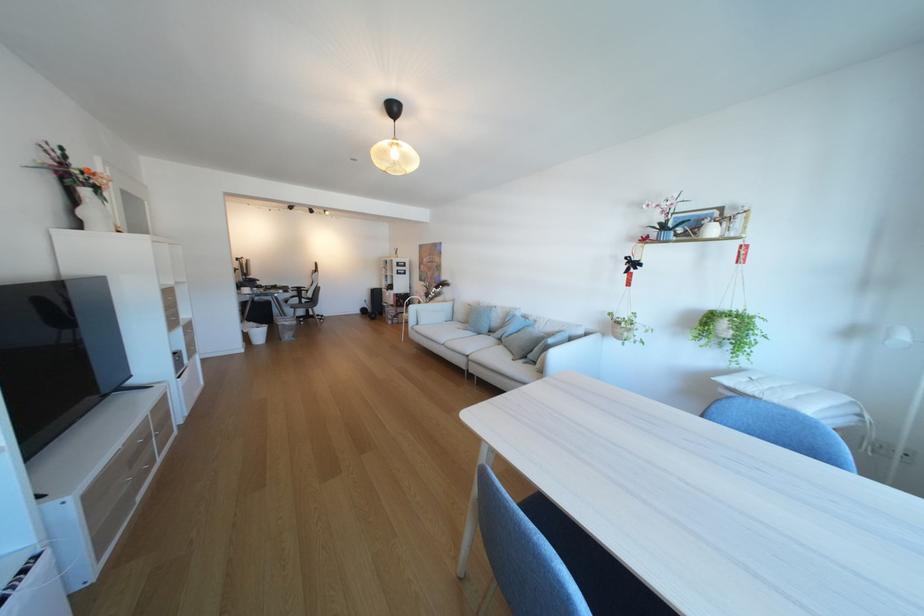
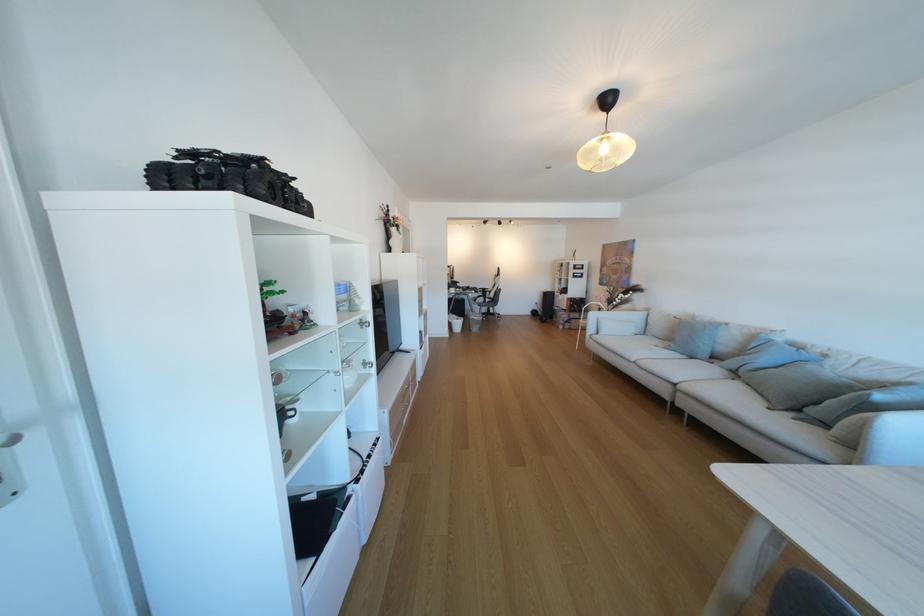
Locate, in the second image, the point that corresponds to the point at 270,329 in the first image.

(468, 321)